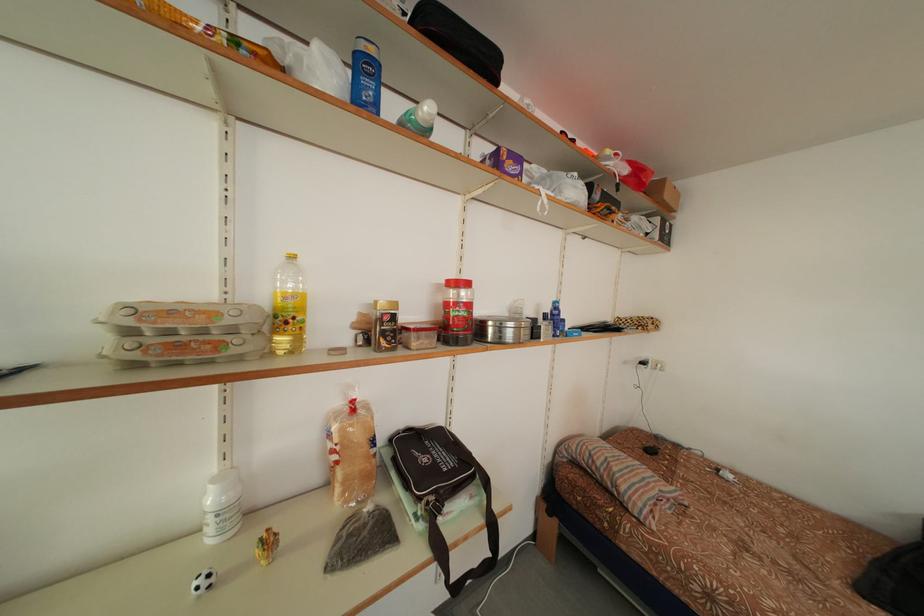
The image size is (924, 616). I want to click on black bag strap, so click(x=441, y=553).